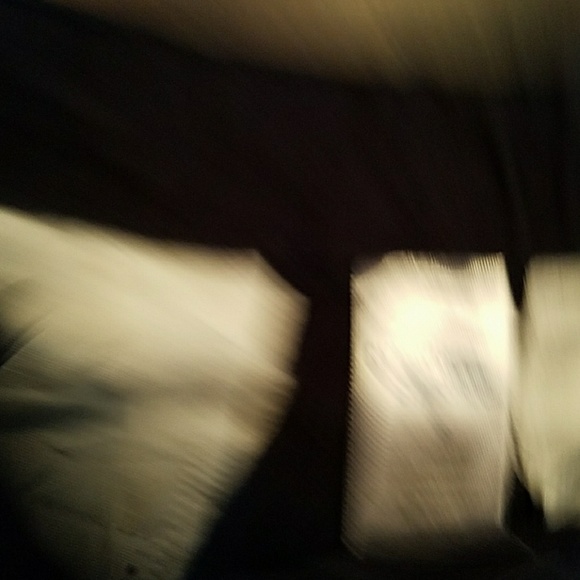
Identify the location of pillow. (90, 268), (416, 353), (557, 372).